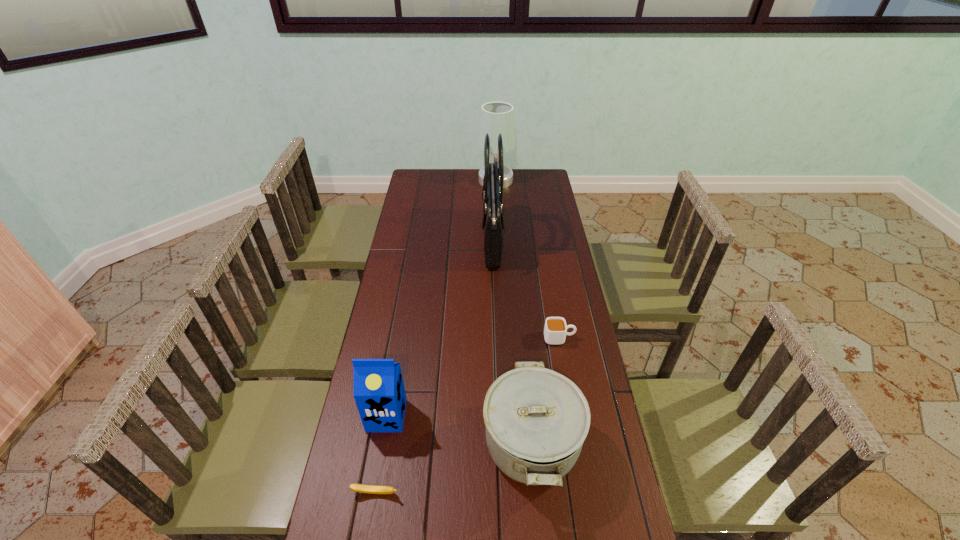
The image size is (960, 540). Find the location of `vacant space situated with an open clasp on the front of the handbag`. vacant space situated with an open clasp on the front of the handbag is located at coordinates (411, 240).

Find the location of `vacant space located 0.350m with an open clasp on the front of the handbag`. vacant space located 0.350m with an open clasp on the front of the handbag is located at coordinates (402, 240).

Where is `vacant space located 0.240m on the base of the second tallest object`? vacant space located 0.240m on the base of the second tallest object is located at coordinates point(432,180).

Locate an element on the screen. Image resolution: width=960 pixels, height=540 pixels. vacant region located 0.280m on the base of the second tallest object is located at coordinates (424, 180).

Locate an element on the screen. The width and height of the screenshot is (960, 540). free space located on the base of the second tallest object is located at coordinates (422, 180).

What are the coordinates of `free spot located with the cap open on the fourth shortest object` in the screenshot? It's located at (368, 524).

The width and height of the screenshot is (960, 540). Find the location of `free space located 0.220m on the back of the saucepan`. free space located 0.220m on the back of the saucepan is located at coordinates (521, 335).

Find the location of a particular element. object that is at the far edge is located at coordinates coord(497,117).

Where is `carton that is at the left edge`? The image size is (960, 540). carton that is at the left edge is located at coordinates (378, 389).

Where is `banana that is positioned at the left edge`? This screenshot has height=540, width=960. banana that is positioned at the left edge is located at coordinates (371, 489).